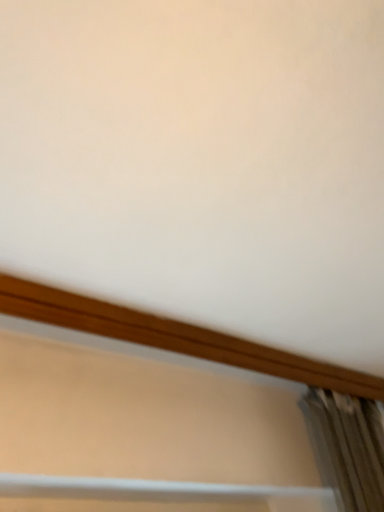
What is the approximate width of wooden frame at upper center?

wooden frame at upper center is 5.84 inches in width.

Describe the element at coordinates (172, 415) in the screenshot. I see `wooden frame at upper center` at that location.

You are a GUI agent. You are given a task and a screenshot of the screen. Output one action in this format:
    pyautogui.click(x=<x>, y=<y>)
    Task: Click on the wooden frame at upper center
    This screenshot has width=384, height=512.
    Given the screenshot: What is the action you would take?
    pyautogui.click(x=172, y=415)

Measure the distance between point (256,365) and camera.

They are 1.31 meters apart.

Identify the location of wooden frame at upper center. This screenshot has height=512, width=384. (172, 415).